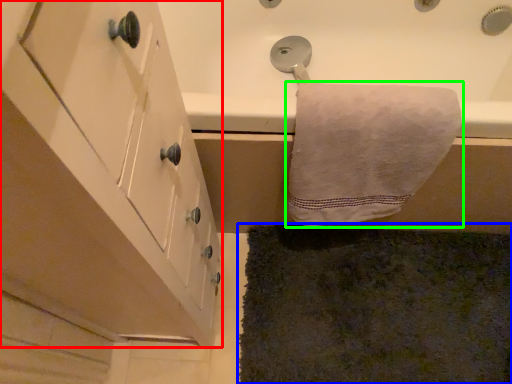
Question: Considering the real-world distances, which object is closest to cabinetry (highlighted by a red box)? bath mat (highlighted by a blue box) or towel (highlighted by a green box).

Choices:
 (A) bath mat
 (B) towel

Answer: (B)